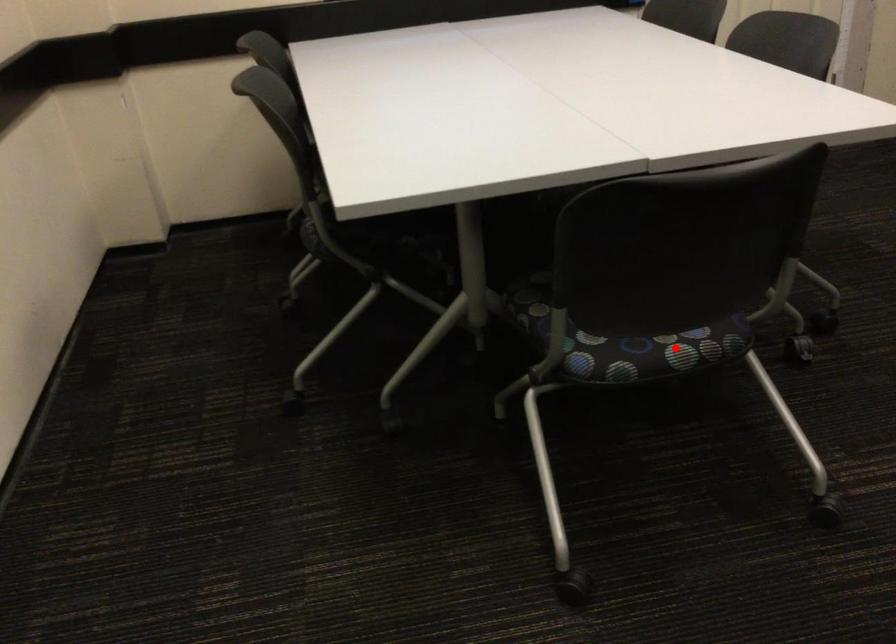
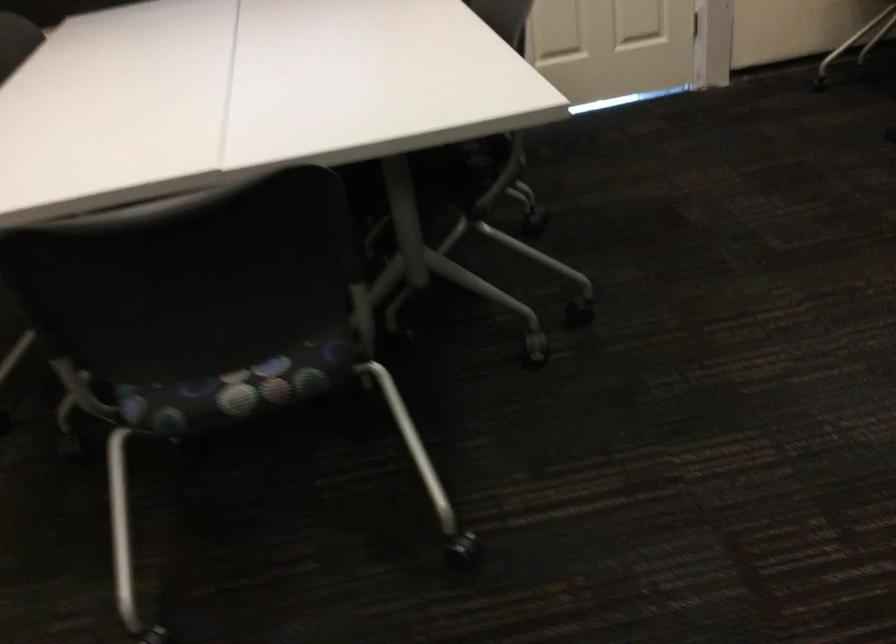
Find the pixel in the second image that matches the highlighted location in the first image.

(234, 389)